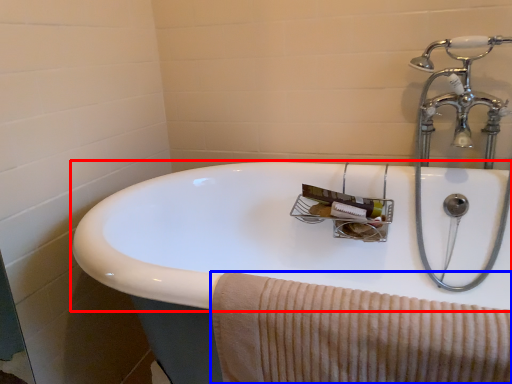
Question: Which object is closer to the camera taking this photo, sink (highlighted by a red box) or bath towel (highlighted by a blue box)?

Choices:
 (A) sink
 (B) bath towel

Answer: (A)